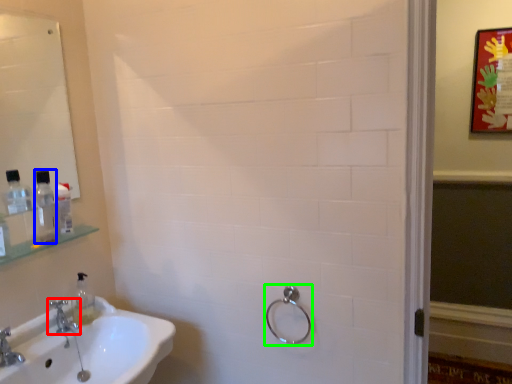
Question: Which object is positioned closest to tap (highlighted by a red box)? Select from mouthwash (highlighted by a blue box) and shower (highlighted by a green box).

Choices:
 (A) mouthwash
 (B) shower

Answer: (A)